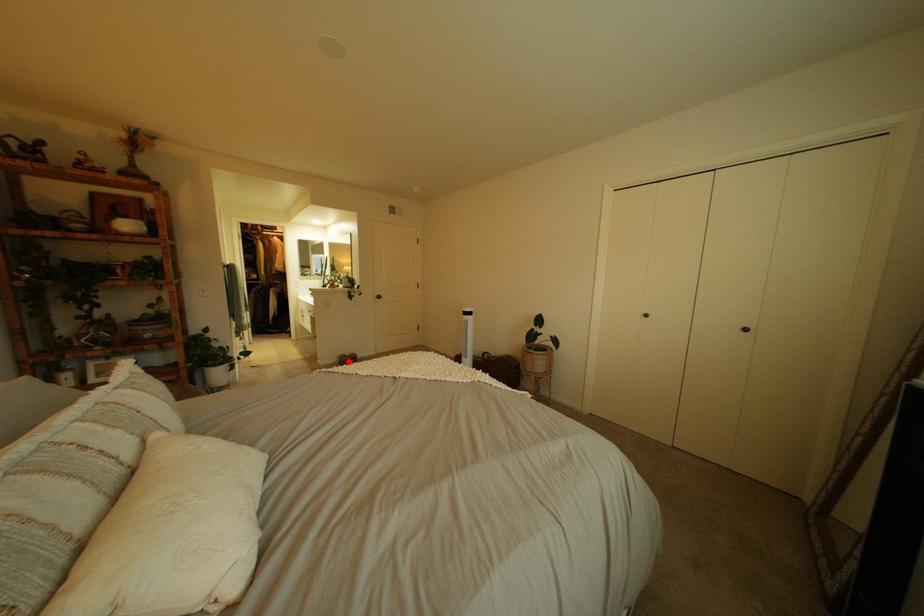
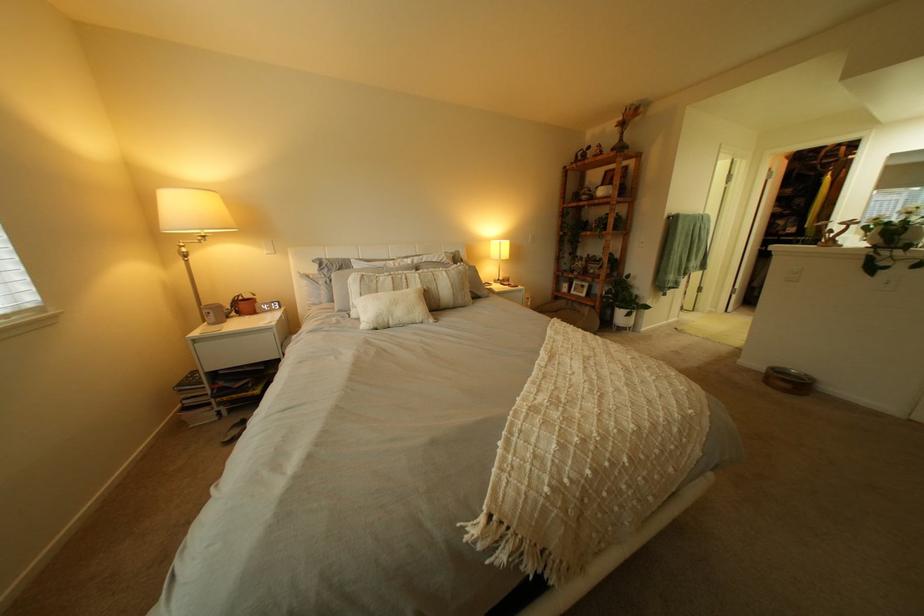
Question: I am providing you with two images of the same scene from different viewpoints. A red point is shown in image1. For the corresponding object point in image2, is it positioned nearer or farther from the camera?

Choices:
 (A) Nearer
 (B) Farther

Answer: (B)